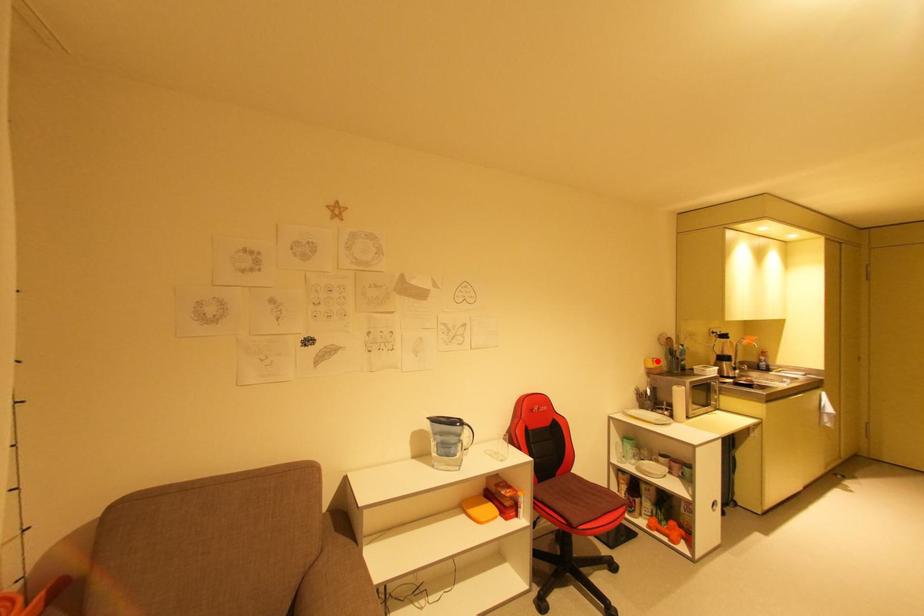
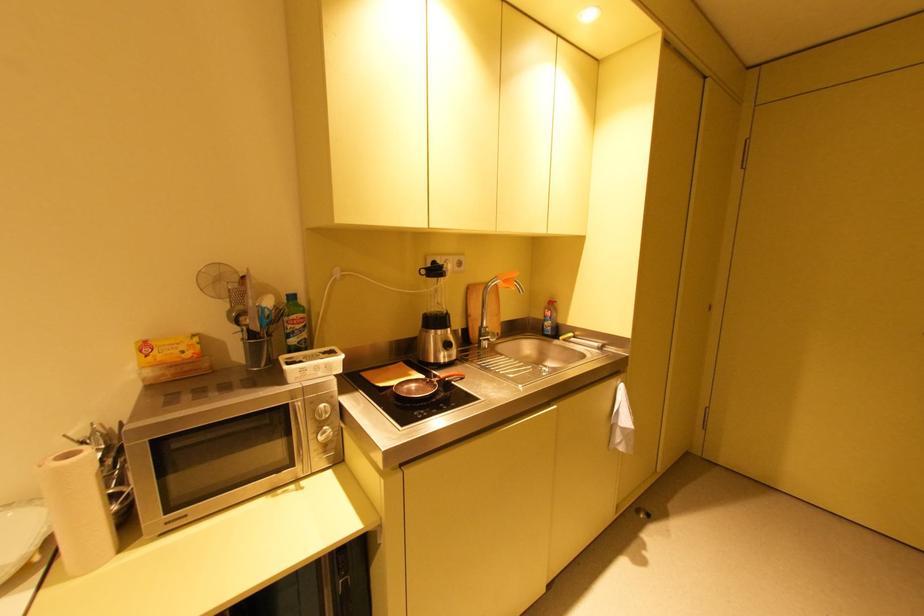
Where in the second image is the point corresponding to the highlighted location from the first image?

(150, 347)